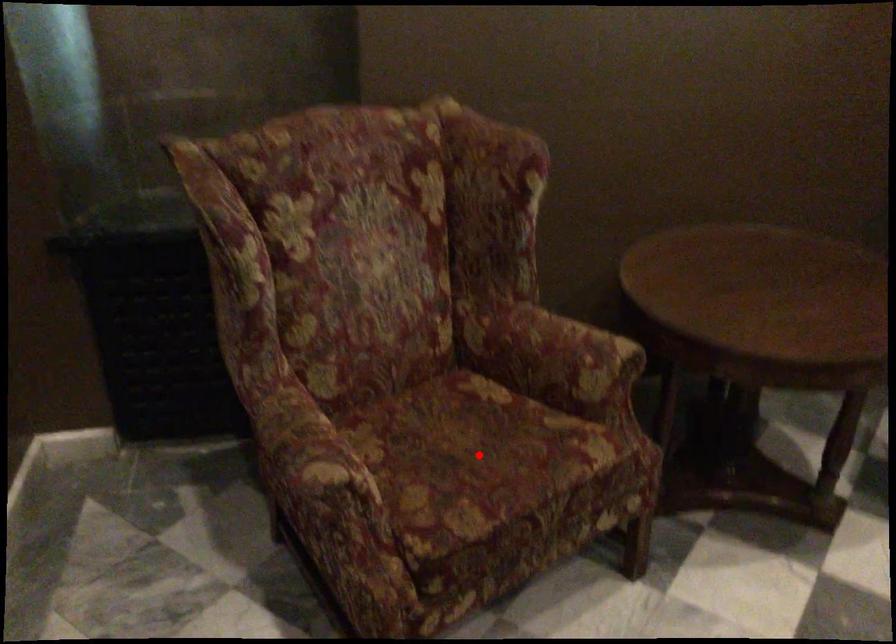
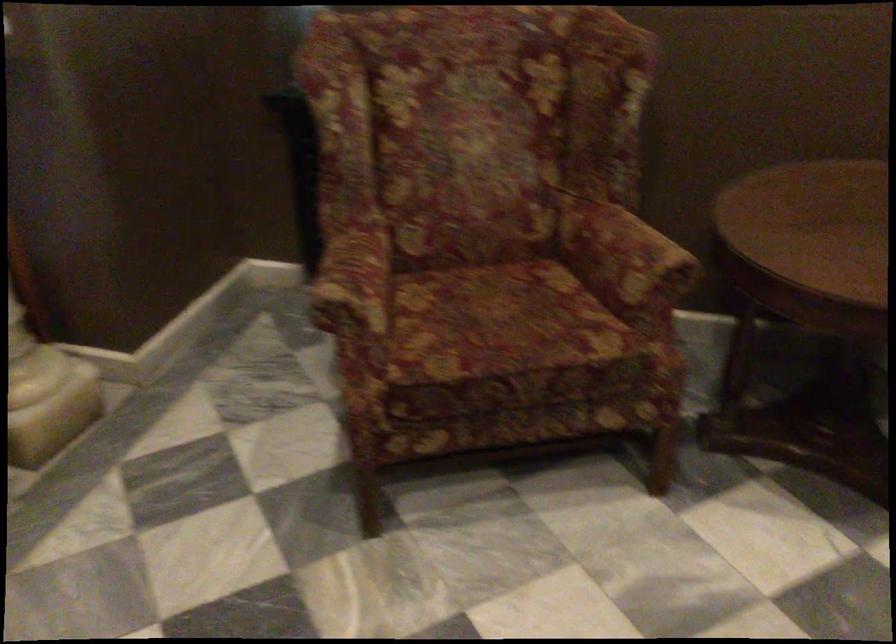
The point at the highlighted location is marked in the first image. Where is the corresponding point in the second image?

(501, 323)